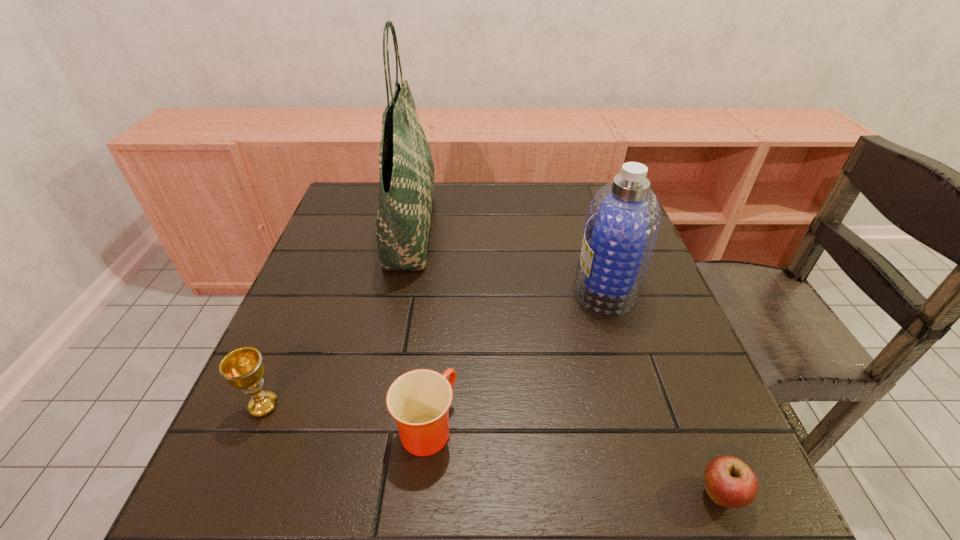
The height and width of the screenshot is (540, 960). I want to click on tote bag, so click(x=406, y=187).

You are a GUI agent. You are given a task and a screenshot of the screen. Output one action in this format:
    pyautogui.click(x=<x>, y=<y>)
    Task: Click on the cleansing agent
    
    Given the screenshot: What is the action you would take?
    pyautogui.click(x=622, y=223)

Where is `chalice`? The height and width of the screenshot is (540, 960). chalice is located at coordinates (243, 368).

Find the location of `cup`. cup is located at coordinates (419, 400).

Locate an element on the screen. This screenshot has width=960, height=540. the nearest object is located at coordinates (729, 482).

The image size is (960, 540). What are the coordinates of `the shortest object` in the screenshot? It's located at (729, 482).

The image size is (960, 540). Find the location of `vacant space located 0.370m on the right of the tallest object`. vacant space located 0.370m on the right of the tallest object is located at coordinates (572, 227).

This screenshot has height=540, width=960. I want to click on vacant region located on the front of the second tallest object, so tap(645, 411).

Where is `vacant space located 0.160m on the back of the leftmost object`? vacant space located 0.160m on the back of the leftmost object is located at coordinates (298, 326).

This screenshot has height=540, width=960. I want to click on vacant space located 0.350m on the right of the cup, so click(664, 427).